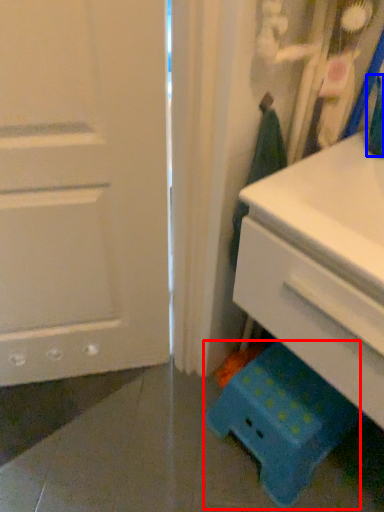
Question: Which object appears closest to the camera in this image, step stool (highlighted by a red box) or teal (highlighted by a blue box)?

Choices:
 (A) step stool
 (B) teal

Answer: (B)